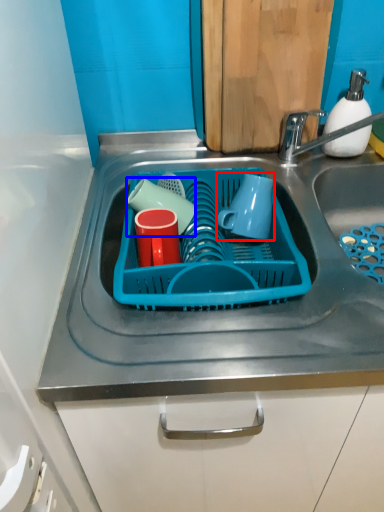
Question: Which of the following is the closest to the observer, mug (highlighted by a red box) or tableware (highlighted by a blue box)?

Choices:
 (A) mug
 (B) tableware

Answer: (A)